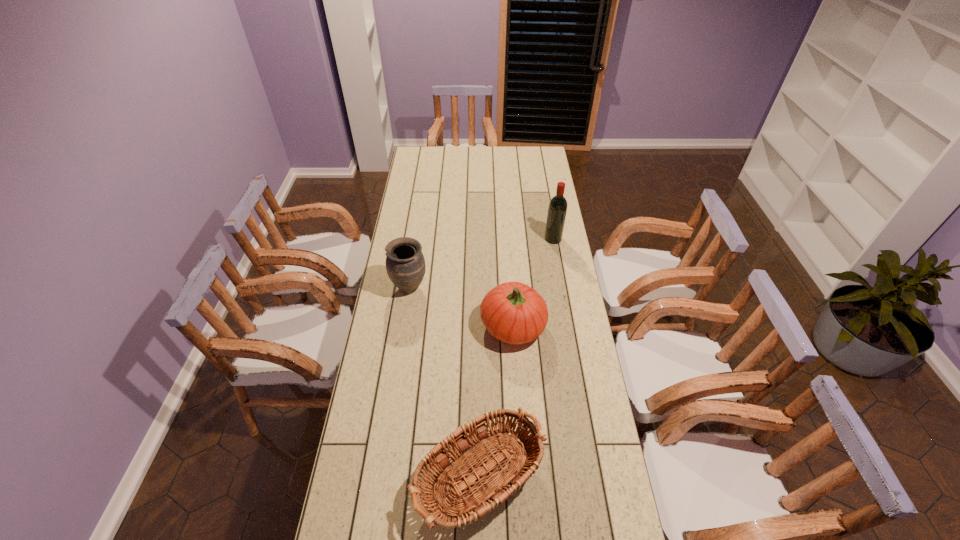
Find the location of a particular element. The width and height of the screenshot is (960, 540). free space between the pumpkin and the urn is located at coordinates (461, 307).

Locate an element on the screen. unoccupied position between the rightmost object and the pumpkin is located at coordinates (533, 282).

You are a GUI agent. You are given a task and a screenshot of the screen. Output one action in this format:
    pyautogui.click(x=<x>, y=<y>)
    Task: Click on the unoccupied area between the urn and the pumpkin
    
    Given the screenshot: What is the action you would take?
    pyautogui.click(x=461, y=307)

Locate an element on the screen. The image size is (960, 540). free space that is in between the urn and the rightmost object is located at coordinates (481, 263).

Locate which object is the third closest to the leftmost object. Please provide its 2D coordinates. Your answer should be formatted as a tuple, i.e. [(x, y)], where the tuple contains the x and y coordinates of a point satisfying the conditions above.

[(557, 209)]

You are a GUI agent. You are given a task and a screenshot of the screen. Output one action in this format:
    pyautogui.click(x=<x>, y=<y>)
    Task: Click on the object that stands as the third closest to the urn
    The width and height of the screenshot is (960, 540).
    Given the screenshot: What is the action you would take?
    pyautogui.click(x=557, y=209)

Where is `free space that satisfies the following two spatial constraints: 1. on the label of the farthest object; 2. on the front side of the urn`? free space that satisfies the following two spatial constraints: 1. on the label of the farthest object; 2. on the front side of the urn is located at coordinates (562, 287).

Where is `vacant space that satisfies the following two spatial constraints: 1. on the front side of the pumpkin; 2. on the left side of the urn`? This screenshot has height=540, width=960. vacant space that satisfies the following two spatial constraints: 1. on the front side of the pumpkin; 2. on the left side of the urn is located at coordinates (403, 326).

You are a GUI agent. You are given a task and a screenshot of the screen. Output one action in this format:
    pyautogui.click(x=<x>, y=<y>)
    Task: Click on the vacant space that satisfies the following two spatial constraints: 1. on the label of the rightmost object; 2. on the front side of the pumpkin
    
    Given the screenshot: What is the action you would take?
    pyautogui.click(x=568, y=326)